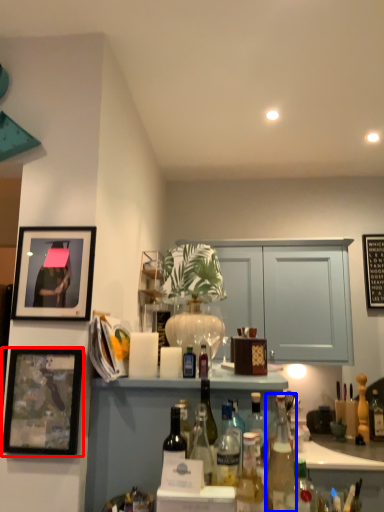
Question: Among these objects, which one is nearest to the camera, picture frame (highlighted by a red box) or bottle (highlighted by a blue box)?

Choices:
 (A) picture frame
 (B) bottle

Answer: (B)